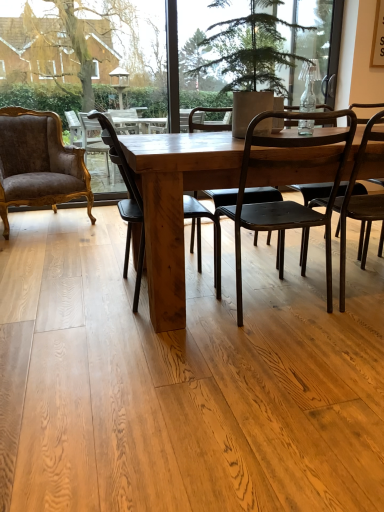
What do you see at coordinates (290, 181) in the screenshot?
I see `matte black chair at center, which appears as the second chair when viewed from the right` at bounding box center [290, 181].

Locate an element on the screen. This screenshot has width=384, height=512. matte black chair at right, which ranks as the 1th chair in right-to-left order is located at coordinates (361, 200).

Where is `green textured plant at center`? The image size is (384, 512). green textured plant at center is located at coordinates (238, 45).

In the scene shown: From the image's perspective, is matte black chair at right, which ranks as the 1th chair in right-to-left order, located above or below velvet brown armchair at left, which is the fourth chair in right-to-left order?

Clearly, from the image's perspective, matte black chair at right, which ranks as the 1th chair in right-to-left order, is below velvet brown armchair at left, which is the fourth chair in right-to-left order.

Is matte black chair at right, positioned as the 4th chair in left-to-right order, facing towards velvet brown armchair at left, acting as the 1th chair starting from the left?

No, matte black chair at right, positioned as the 4th chair in left-to-right order, is not facing towards velvet brown armchair at left, acting as the 1th chair starting from the left.

Does point (342, 248) come farther from viewer compared to point (52, 121)?

No, it is not.

Would you say matte black chair at right, positioned as the 4th chair in left-to-right order, is inside or outside velvet brown armchair at left, which is the fourth chair in right-to-left order?

matte black chair at right, positioned as the 4th chair in left-to-right order, cannot be found inside velvet brown armchair at left, which is the fourth chair in right-to-left order.

Does matte black chair at center, which appears as the second chair when viewed from the right, appear on the right side of green textured plant at center?

Yes, matte black chair at center, which appears as the second chair when viewed from the right, is to the right of green textured plant at center.

Is green textured plant at center located within matte black chair at center, which appears as the second chair when viewed from the right?

No, matte black chair at center, which appears as the second chair when viewed from the right, does not contain green textured plant at center.

Is matte black chair at center, which appears as the second chair when viewed from the right, taller or shorter than green textured plant at center?

Clearly, matte black chair at center, which appears as the second chair when viewed from the right, is taller compared to green textured plant at center.

Relative to green textured plant at center, is matte black chair at center, which appears as the second chair when viewed from the right, in front or behind?

Clearly, matte black chair at center, which appears as the second chair when viewed from the right, is in front of green textured plant at center.

From a real-world perspective, is velvet brown armchair at left, which is the fourth chair in right-to-left order, physically located above or below wooden chair at center, which appears as the 2th chair when viewed from the left?

From a real-world perspective, velvet brown armchair at left, which is the fourth chair in right-to-left order, is physically above wooden chair at center, which appears as the 2th chair when viewed from the left.

Is velvet brown armchair at left, which is the fourth chair in right-to-left order, touching wooden chair at center, which appears as the 2th chair when viewed from the left?

No, velvet brown armchair at left, which is the fourth chair in right-to-left order, is not making contact with wooden chair at center, which appears as the 2th chair when viewed from the left.

In the scene shown: From the image's perspective, relative to wooden chair at center, which appears as the 2th chair when viewed from the left, is velvet brown armchair at left, which is the fourth chair in right-to-left order, above or below?

velvet brown armchair at left, which is the fourth chair in right-to-left order, is above wooden chair at center, which appears as the 2th chair when viewed from the left.

Which object is wider, velvet brown armchair at left, acting as the 1th chair starting from the left, or wooden chair at center, positioned as the third chair in right-to-left order?

With larger width is velvet brown armchair at left, acting as the 1th chair starting from the left.

How many degrees apart are the facing directions of matte black chair at center, acting as the 3th chair starting from the left, and velvet brown armchair at left, which is the fourth chair in right-to-left order?

160 degrees separate the facing orientations of matte black chair at center, acting as the 3th chair starting from the left, and velvet brown armchair at left, which is the fourth chair in right-to-left order.

Locate an element on the screen. This screenshot has width=384, height=512. the 2nd chair counting from the right side of the velvet brown armchair at left, which is the fourth chair in right-to-left order is located at coordinates (290, 181).

Between matte black chair at center, which appears as the second chair when viewed from the right, and velvet brown armchair at left, which is the fourth chair in right-to-left order, which one has more height?

With more height is matte black chair at center, which appears as the second chair when viewed from the right.

Is matte black chair at center, which appears as the second chair when viewed from the right, looking in the opposite direction of velvet brown armchair at left, which is the fourth chair in right-to-left order?

No, matte black chair at center, which appears as the second chair when viewed from the right,'s orientation is not away from velvet brown armchair at left, which is the fourth chair in right-to-left order.

Is green textured plant at center behind wooden chair at center, positioned as the third chair in right-to-left order?

No.

Is point (263, 22) positioned after point (196, 213)?

Yes.

What's the angular difference between green textured plant at center and wooden chair at center, which appears as the 2th chair when viewed from the left,'s facing directions?

They differ by 4.06 degrees in their facing directions.

Is green textured plant at center inside or outside of wooden chair at center, which appears as the 2th chair when viewed from the left?

The correct answer is: outside.

Is wooden chair at center, positioned as the third chair in right-to-left order, touching velvet brown armchair at left, acting as the 1th chair starting from the left?

No, wooden chair at center, positioned as the third chair in right-to-left order, is not beside velvet brown armchair at left, acting as the 1th chair starting from the left.

Is wooden chair at center, positioned as the third chair in right-to-left order, located outside velvet brown armchair at left, acting as the 1th chair starting from the left?

Yes, wooden chair at center, positioned as the third chair in right-to-left order, is not within velvet brown armchair at left, acting as the 1th chair starting from the left.

In the scene shown: Considering the positions of objects wooden chair at center, which appears as the 2th chair when viewed from the left, and velvet brown armchair at left, which is the fourth chair in right-to-left order, in the image provided, who is behind, wooden chair at center, which appears as the 2th chair when viewed from the left, or velvet brown armchair at left, which is the fourth chair in right-to-left order,?

Positioned behind is velvet brown armchair at left, which is the fourth chair in right-to-left order.

Is the position of velvet brown armchair at left, which is the fourth chair in right-to-left order, less distant than that of green textured plant at center?

No, velvet brown armchair at left, which is the fourth chair in right-to-left order, is further to the viewer.

Visually, is velvet brown armchair at left, which is the fourth chair in right-to-left order, positioned to the left or to the right of green textured plant at center?

In the image, velvet brown armchair at left, which is the fourth chair in right-to-left order, appears on the left side of green textured plant at center.

From a real-world perspective, who is located lower, velvet brown armchair at left, acting as the 1th chair starting from the left, or green textured plant at center?

From a 3D spatial view, velvet brown armchair at left, acting as the 1th chair starting from the left, is below.

Is velvet brown armchair at left, acting as the 1th chair starting from the left, touching green textured plant at center?

There is a gap between velvet brown armchair at left, acting as the 1th chair starting from the left, and green textured plant at center.

From the velvet brown armchair at left, acting as the 1th chair starting from the left, count 3rd chair to the right and point to it. Please provide its 2D coordinates.

[(361, 200)]

Where is `tree that appears on the left of matte black chair at center, acting as the 3th chair starting from the left`? tree that appears on the left of matte black chair at center, acting as the 3th chair starting from the left is located at coordinates (238, 45).

Estimate the real-world distances between objects in this image. Which object is closer to matte black chair at center, acting as the 3th chair starting from the left, wooden chair at center, positioned as the third chair in right-to-left order, or velvet brown armchair at left, acting as the 1th chair starting from the left?

wooden chair at center, positioned as the third chair in right-to-left order, is closer to matte black chair at center, acting as the 3th chair starting from the left.

From the image, which object appears to be nearer to matte black chair at right, which ranks as the 1th chair in right-to-left order, matte black chair at center, acting as the 3th chair starting from the left, or velvet brown armchair at left, which is the fourth chair in right-to-left order?

matte black chair at center, acting as the 3th chair starting from the left, is positioned closer to the anchor matte black chair at right, which ranks as the 1th chair in right-to-left order.

From the image, which object appears to be nearer to matte black chair at center, acting as the 3th chair starting from the left, wooden chair at center, positioned as the third chair in right-to-left order, or matte black chair at right, positioned as the 4th chair in left-to-right order?

Among the two, matte black chair at right, positioned as the 4th chair in left-to-right order, is located nearer to matte black chair at center, acting as the 3th chair starting from the left.

Based on their spatial positions, is green textured plant at center or velvet brown armchair at left, which is the fourth chair in right-to-left order, further from wooden chair at center, positioned as the third chair in right-to-left order?

The object further to wooden chair at center, positioned as the third chair in right-to-left order, is velvet brown armchair at left, which is the fourth chair in right-to-left order.

When comparing their distances from matte black chair at right, which ranks as the 1th chair in right-to-left order, does wooden chair at center, positioned as the third chair in right-to-left order, or green textured plant at center seem closer?

Based on the image, wooden chair at center, positioned as the third chair in right-to-left order, appears to be nearer to matte black chair at right, which ranks as the 1th chair in right-to-left order.

When comparing their distances from matte black chair at center, acting as the 3th chair starting from the left, does velvet brown armchair at left, which is the fourth chair in right-to-left order, or green textured plant at center seem closer?

Among the two, green textured plant at center is located nearer to matte black chair at center, acting as the 3th chair starting from the left.

When comparing their distances from velvet brown armchair at left, which is the fourth chair in right-to-left order, does green textured plant at center or matte black chair at center, which appears as the second chair when viewed from the right, seem closer?

green textured plant at center lies closer to velvet brown armchair at left, which is the fourth chair in right-to-left order, than the other object.

Considering their positions, is matte black chair at center, acting as the 3th chair starting from the left, positioned closer to wooden chair at center, which appears as the 2th chair when viewed from the left, than matte black chair at right, positioned as the 4th chair in left-to-right order?

matte black chair at center, acting as the 3th chair starting from the left, is positioned closer to the anchor wooden chair at center, which appears as the 2th chair when viewed from the left.

This screenshot has height=512, width=384. I want to click on chair situated between wooden chair at center, positioned as the third chair in right-to-left order, and matte black chair at right, positioned as the 4th chair in left-to-right order, from left to right, so click(290, 181).

Identify the location of tree located between velvet brown armchair at left, acting as the 1th chair starting from the left, and matte black chair at center, which appears as the second chair when viewed from the right, in the left-right direction. This screenshot has height=512, width=384. (238, 45).

I want to click on tree between velvet brown armchair at left, acting as the 1th chair starting from the left, and matte black chair at right, positioned as the 4th chair in left-to-right order, from left to right, so click(238, 45).

Where is `tree between wooden chair at center, positioned as the third chair in right-to-left order, and matte black chair at right, which ranks as the 1th chair in right-to-left order, in the horizontal direction`? The width and height of the screenshot is (384, 512). tree between wooden chair at center, positioned as the third chair in right-to-left order, and matte black chair at right, which ranks as the 1th chair in right-to-left order, in the horizontal direction is located at coordinates click(x=238, y=45).